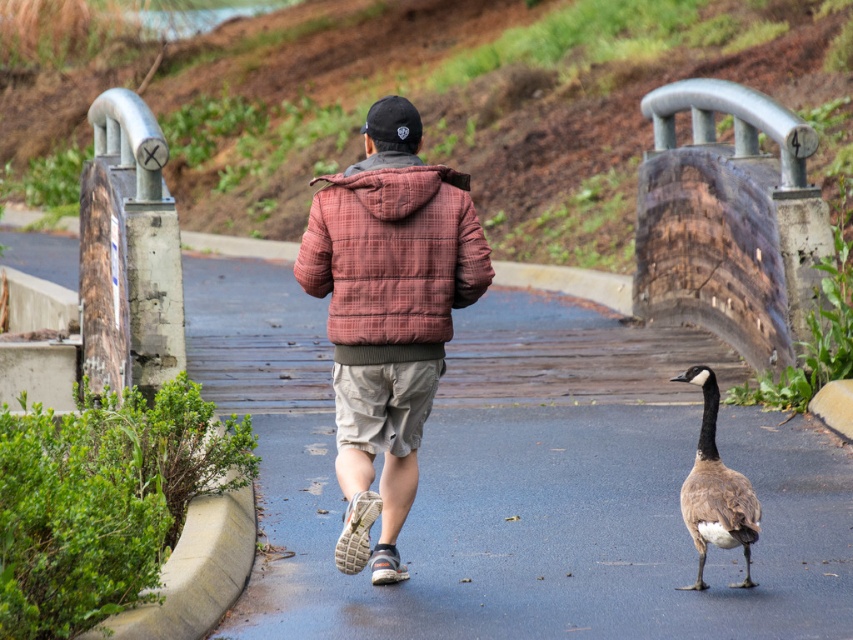
This screenshot has height=640, width=853. Identify the location of plaid quilted jacket at center. (392, 257).

Looking at this image, can you confirm if plaid quilted jacket at center is positioned to the left of brown feathered duck at center?

Yes, plaid quilted jacket at center is to the left of brown feathered duck at center.

Which is behind, point (392, 252) or point (698, 458)?

Positioned behind is point (698, 458).

Where is `plaid quilted jacket at center`? The image size is (853, 640). plaid quilted jacket at center is located at coordinates (392, 257).

Who is taller, plaid cotton jacket at center or brown feathered duck at center?

plaid cotton jacket at center

Identify the location of plaid cotton jacket at center. (387, 314).

Does point (405, 205) lie behind point (741, 532)?

That is True.

This screenshot has width=853, height=640. Find the location of `plaid cotton jacket at center`. plaid cotton jacket at center is located at coordinates (387, 314).

Does smooth asphalt road at center come in front of plaid cotton jacket at center?

Yes, it is in front of plaid cotton jacket at center.

Does point (479, 323) come behind point (347, 449)?

Yes.

Image resolution: width=853 pixels, height=640 pixels. What are the coordinates of `smooth asphalt road at center` in the screenshot? It's located at point(521,477).

Identify the location of smooth asphalt road at center. The width and height of the screenshot is (853, 640). (521, 477).